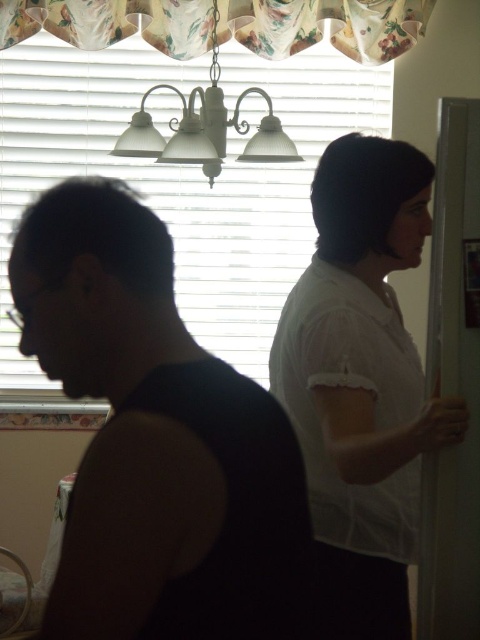
Does black matte shirt at left appear over white textured lamp at upper center?

Incorrect, black matte shirt at left is not positioned above white textured lamp at upper center.

Who is more forward, (x=79, y=250) or (x=190, y=147)?

Point (x=79, y=250)

The height and width of the screenshot is (640, 480). In order to click on black matte shirt at left in this screenshot , I will do `click(156, 440)`.

Which is behind, point (14, 246) or point (210, 272)?

Positioned behind is point (210, 272).

Describe the element at coordinates (156, 440) in the screenshot. I see `black matte shirt at left` at that location.

This screenshot has height=640, width=480. Describe the element at coordinates (156, 440) in the screenshot. I see `black matte shirt at left` at that location.

I want to click on black matte shirt at left, so click(x=156, y=440).

Does black matte shirt at left have a larger size compared to floral fabric valance at upper center?

No.

Can you confirm if black matte shirt at left is taller than floral fabric valance at upper center?

Yes.

Locate an element on the screen. black matte shirt at left is located at coordinates (156, 440).